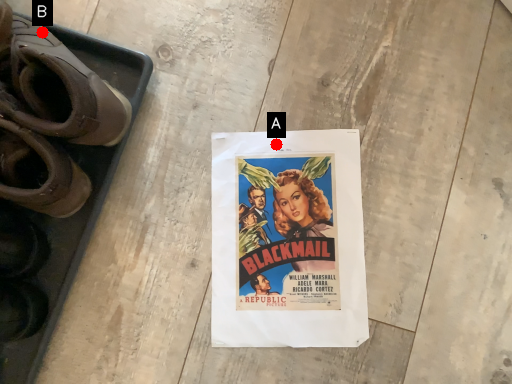
Question: Two points are circled on the image, labeled by A and B beside each circle. Which point is farther from the camera taking this photo?

Choices:
 (A) A is further
 (B) B is further

Answer: (B)